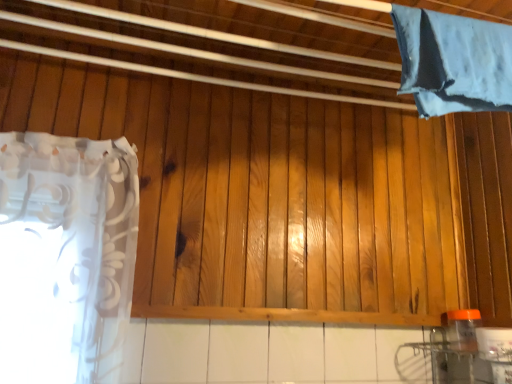
Question: From the image's perspective, is orange translucent bottle at lower right above or below white sheer curtain at left, the second curtain from the top?

Choices:
 (A) above
 (B) below

Answer: (B)

Question: Do you think orange translucent bottle at lower right is within white sheer curtain at left, arranged as the 1th curtain when viewed from the left, or outside of it?

Choices:
 (A) outside
 (B) inside

Answer: (A)

Question: Which object is positioned farthest from the blue fabric at upper right, acting as the second curtain starting from the bottom?

Choices:
 (A) orange translucent bottle at lower right
 (B) white sheer curtain at left, which ranks as the 1th curtain in bottom-to-top order

Answer: (B)

Question: Considering the real-world distances, which object is closest to the blue fabric at upper right, the 1th curtain from the top?

Choices:
 (A) orange translucent bottle at lower right
 (B) white sheer curtain at left, which ranks as the 1th curtain in bottom-to-top order

Answer: (A)